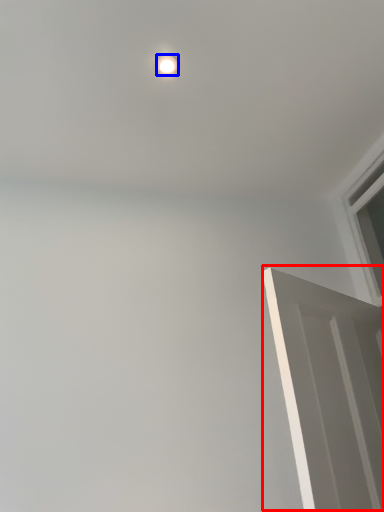
Question: Among these objects, which one is nearest to the camera, door (highlighted by a red box) or lighting (highlighted by a blue box)?

Choices:
 (A) door
 (B) lighting

Answer: (A)